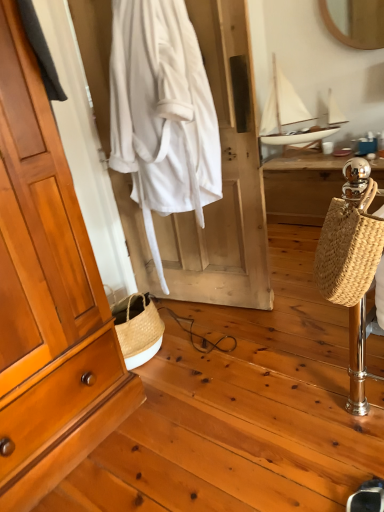
Identify the location of free space in front of white matte coffee cup at center. The image size is (384, 512). (332, 160).